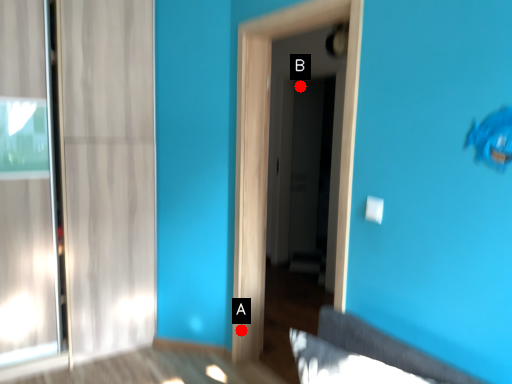
Question: Two points are circled on the image, labeled by A and B beside each circle. Which point is closer to the camera?

Choices:
 (A) A is closer
 (B) B is closer

Answer: (A)